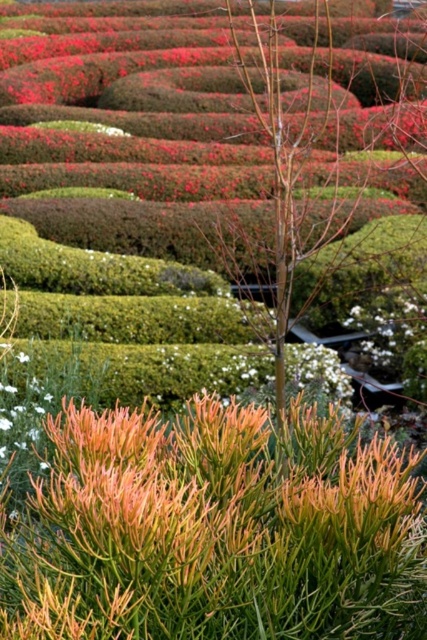
Question: Is white matte flower at center bigger than green matte flower at center?

Choices:
 (A) yes
 (B) no

Answer: (A)

Question: Does white matte flower at center have a lesser width compared to green matte flower at center?

Choices:
 (A) no
 (B) yes

Answer: (A)

Question: Which point is closer to the camera?

Choices:
 (A) pyautogui.click(x=23, y=355)
 (B) pyautogui.click(x=353, y=358)

Answer: (A)

Question: Does white matte flower at center come in front of green matte flower at center?

Choices:
 (A) yes
 (B) no

Answer: (B)